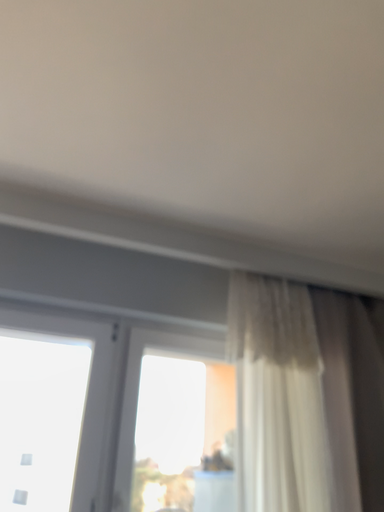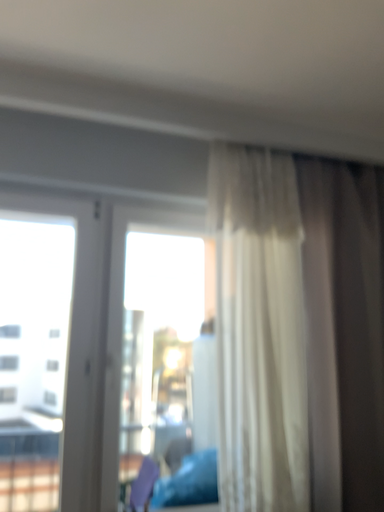
Question: Which way did the camera rotate in the video?

Choices:
 (A) rotated upward
 (B) rotated downward

Answer: (B)